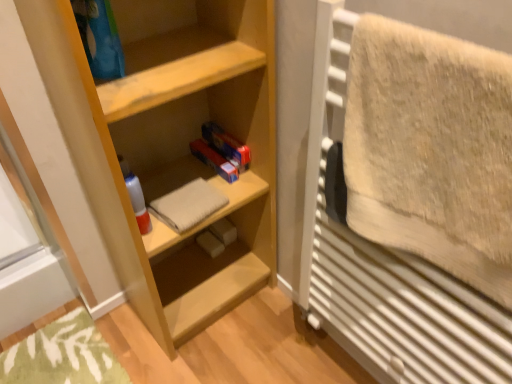
What do you see at coordinates (188, 205) in the screenshot? I see `beige cotton towel at center, the 2th bath towel viewed from the right` at bounding box center [188, 205].

The width and height of the screenshot is (512, 384). What are the coordinates of `light wood shelf at center` in the screenshot? It's located at (188, 146).

Is beige cotton towel at center, which appears as the first bath towel when viewed from the left, oriented away from light wood shelf at center?

That's right, beige cotton towel at center, which appears as the first bath towel when viewed from the left, is facing away from light wood shelf at center.

From the image's perspective, between beige cotton towel at center, the 2th bath towel viewed from the right, and light wood shelf at center, who is located below?

beige cotton towel at center, the 2th bath towel viewed from the right, appears lower in the image.

Which is more to the right, beige cotton towel at center, which is counted as the first bath towel, starting from the back, or light wood shelf at center?

From the viewer's perspective, light wood shelf at center appears more on the right side.

Is the position of beige cotton towel at center, which is counted as the first bath towel, starting from the back, less distant than that of light wood shelf at center?

No, it is not.

Which of these two, beige fluffy towel at right, which appears as the second bath towel when viewed from the left, or light wood shelf at center, is smaller?

Smaller between the two is beige fluffy towel at right, which appears as the second bath towel when viewed from the left.

Can light wood shelf at center be found inside beige fluffy towel at right, acting as the 1th bath towel starting from the right?

No, light wood shelf at center is not inside beige fluffy towel at right, acting as the 1th bath towel starting from the right.

How many degrees apart are the facing directions of beige fluffy towel at right, which ranks as the 1th bath towel in front-to-back order, and light wood shelf at center?

87.5 degrees separate the facing orientations of beige fluffy towel at right, which ranks as the 1th bath towel in front-to-back order, and light wood shelf at center.

Does point (481, 258) appear closer or farther from the camera than point (140, 153)?

Point (481, 258).

From the image's perspective, is beige fluffy towel at right, which is the 2th bath towel in back-to-front order, over beige cotton towel at center, the 2th bath towel viewed from the right?

Yes.

From a real-world perspective, is beige fluffy towel at right, acting as the 1th bath towel starting from the right, physically located above or below beige cotton towel at center, which is counted as the first bath towel, starting from the back?

beige fluffy towel at right, acting as the 1th bath towel starting from the right, is above beige cotton towel at center, which is counted as the first bath towel, starting from the back.

Would you say beige fluffy towel at right, which ranks as the 1th bath towel in front-to-back order, is inside or outside beige cotton towel at center, acting as the 2th bath towel starting from the front?

beige fluffy towel at right, which ranks as the 1th bath towel in front-to-back order, is spatially situated outside beige cotton towel at center, acting as the 2th bath towel starting from the front.

Can you tell me how much beige fluffy towel at right, acting as the 1th bath towel starting from the right, and beige cotton towel at center, acting as the 2th bath towel starting from the front, differ in facing direction?

The angle between the facing direction of beige fluffy towel at right, acting as the 1th bath towel starting from the right, and the facing direction of beige cotton towel at center, acting as the 2th bath towel starting from the front, is 92.9 degrees.

From the image's perspective, is light wood shelf at center under beige cotton towel at center, which appears as the first bath towel when viewed from the left?

No.

Is light wood shelf at center not inside beige cotton towel at center, acting as the 2th bath towel starting from the front?

Absolutely, light wood shelf at center is external to beige cotton towel at center, acting as the 2th bath towel starting from the front.

Where is `bath towel on the left of light wood shelf at center`? The height and width of the screenshot is (384, 512). bath towel on the left of light wood shelf at center is located at coordinates (188, 205).

Considering the sizes of objects light wood shelf at center and beige fluffy towel at right, which is the 2th bath towel in back-to-front order, in the image provided, who is bigger, light wood shelf at center or beige fluffy towel at right, which is the 2th bath towel in back-to-front order,?

light wood shelf at center.

Considering the relative sizes of light wood shelf at center and beige fluffy towel at right, which ranks as the 1th bath towel in front-to-back order, in the image provided, is light wood shelf at center shorter than beige fluffy towel at right, which ranks as the 1th bath towel in front-to-back order,?

No.

Image resolution: width=512 pixels, height=384 pixels. There is a light wood shelf at center. What are the coordinates of `the 1st bath towel below it (from the image's perspective)` in the screenshot? It's located at (431, 150).

From a real-world perspective, is light wood shelf at center on beige fluffy towel at right, which ranks as the 1th bath towel in front-to-back order?

No.

Is there a large distance between beige cotton towel at center, which appears as the first bath towel when viewed from the left, and beige fluffy towel at right, which appears as the second bath towel when viewed from the left?

beige cotton towel at center, which appears as the first bath towel when viewed from the left, is near beige fluffy towel at right, which appears as the second bath towel when viewed from the left, not far away.

Is beige cotton towel at center, which is counted as the first bath towel, starting from the back, oriented towards beige fluffy towel at right, which is the 2th bath towel in back-to-front order?

No, beige cotton towel at center, which is counted as the first bath towel, starting from the back, is not facing towards beige fluffy towel at right, which is the 2th bath towel in back-to-front order.

Considering the sizes of beige cotton towel at center, the 2th bath towel viewed from the right, and beige fluffy towel at right, which ranks as the 1th bath towel in front-to-back order, in the image, is beige cotton towel at center, the 2th bath towel viewed from the right, bigger or smaller than beige fluffy towel at right, which ranks as the 1th bath towel in front-to-back order,?

In the image, beige cotton towel at center, the 2th bath towel viewed from the right, appears to be smaller than beige fluffy towel at right, which ranks as the 1th bath towel in front-to-back order.

From the image's perspective, who appears lower, beige cotton towel at center, the 2th bath towel viewed from the right, or beige fluffy towel at right, acting as the 1th bath towel starting from the right?

beige cotton towel at center, the 2th bath towel viewed from the right, is shown below in the image.

I want to click on shelf that appears above the beige cotton towel at center, which is counted as the first bath towel, starting from the back (from a real-world perspective), so click(x=188, y=146).

What are the coordinates of `shelf on the left of beige fluffy towel at right, which is the 2th bath towel in back-to-front order` in the screenshot? It's located at (188, 146).

Considering their positions, is beige cotton towel at center, acting as the 2th bath towel starting from the front, positioned closer to beige fluffy towel at right, which ranks as the 1th bath towel in front-to-back order, than light wood shelf at center?

light wood shelf at center lies closer to beige fluffy towel at right, which ranks as the 1th bath towel in front-to-back order, than the other object.

Based on their spatial positions, is beige cotton towel at center, which is counted as the first bath towel, starting from the back, or beige fluffy towel at right, which is the 2th bath towel in back-to-front order, further from light wood shelf at center?

The object further to light wood shelf at center is beige fluffy towel at right, which is the 2th bath towel in back-to-front order.

Considering their positions, is beige fluffy towel at right, which is the 2th bath towel in back-to-front order, positioned further to beige cotton towel at center, the 2th bath towel viewed from the right, than light wood shelf at center?

Among the two, beige fluffy towel at right, which is the 2th bath towel in back-to-front order, is located further to beige cotton towel at center, the 2th bath towel viewed from the right.

Consider the image. From the image, which object appears to be nearer to beige cotton towel at center, the 2th bath towel viewed from the right, light wood shelf at center or beige fluffy towel at right, which is the 2th bath towel in back-to-front order?

light wood shelf at center is closer to beige cotton towel at center, the 2th bath towel viewed from the right.

From the picture: Looking at the image, which one is located further to light wood shelf at center, beige fluffy towel at right, which is the 2th bath towel in back-to-front order, or beige cotton towel at center, acting as the 2th bath towel starting from the front?

The object further to light wood shelf at center is beige fluffy towel at right, which is the 2th bath towel in back-to-front order.

Which object lies nearer to the anchor point beige fluffy towel at right, which appears as the second bath towel when viewed from the left, light wood shelf at center or beige cotton towel at center, which is counted as the first bath towel, starting from the back?

Among the two, light wood shelf at center is located nearer to beige fluffy towel at right, which appears as the second bath towel when viewed from the left.

You are a GUI agent. You are given a task and a screenshot of the screen. Output one action in this format:
    pyautogui.click(x=<x>, y=<y>)
    Task: Click on the shelf between beige fluffy towel at right, which ranks as the 1th bath towel in front-to-back order, and beige cotton towel at center, which is counted as the first bath towel, starting from the back, in the front-back direction
    
    Given the screenshot: What is the action you would take?
    pyautogui.click(x=188, y=146)